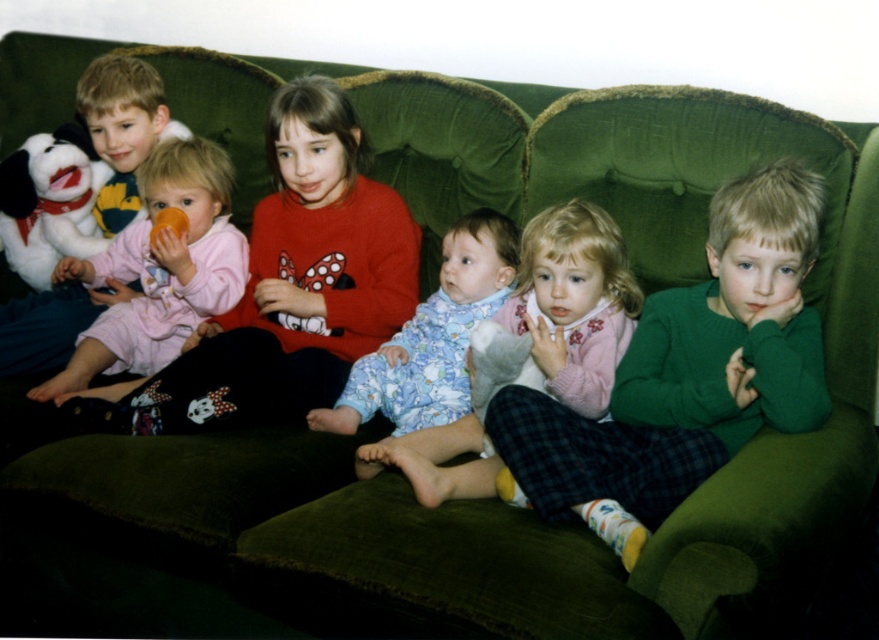
Between fluffy white teddy bear at center and white plush toy at left, which one has less height?

With less height is white plush toy at left.

Between point (569, 272) and point (77, 216), which one is positioned behind?

The point (77, 216) is more distant.

This screenshot has height=640, width=879. I want to click on fluffy white teddy bear at center, so click(575, 301).

Is fluffy blue pajamas at center closer to camera compared to white plush toy at left?

Yes.

Between point (513, 248) and point (27, 259), which one is positioned behind?

Point (27, 259)

The height and width of the screenshot is (640, 879). I want to click on fluffy blue pajamas at center, so click(x=432, y=337).

Can you confirm if pink fleece onesie at left is positioned to the left of white plush toy at left?

No, pink fleece onesie at left is not to the left of white plush toy at left.

From the picture: Is pink fleece onesie at left above white plush toy at left?

No.

Find the location of `pink fleece onesie at left`. pink fleece onesie at left is located at coordinates (158, 273).

What are the coordinates of `pink fleece onesie at left` in the screenshot? It's located at (158, 273).